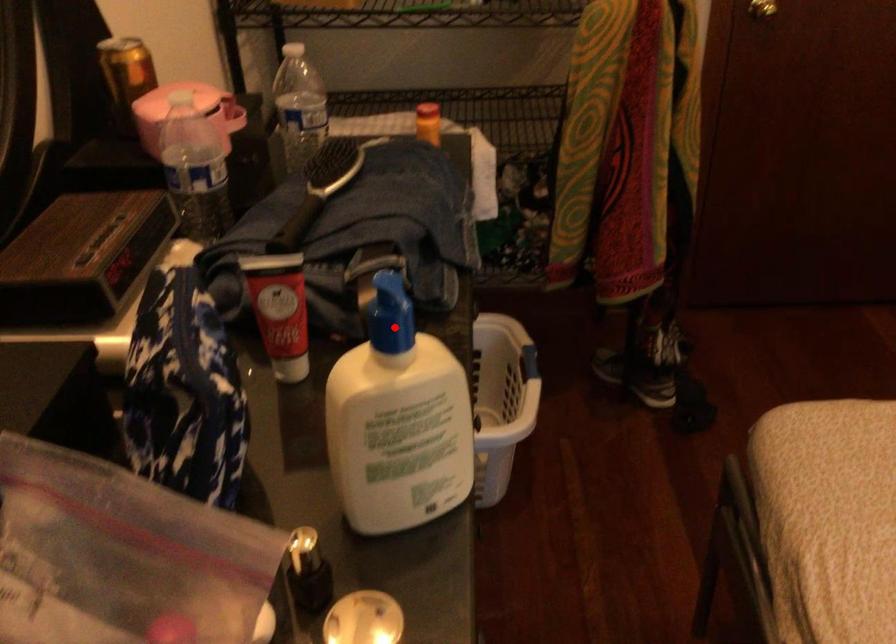
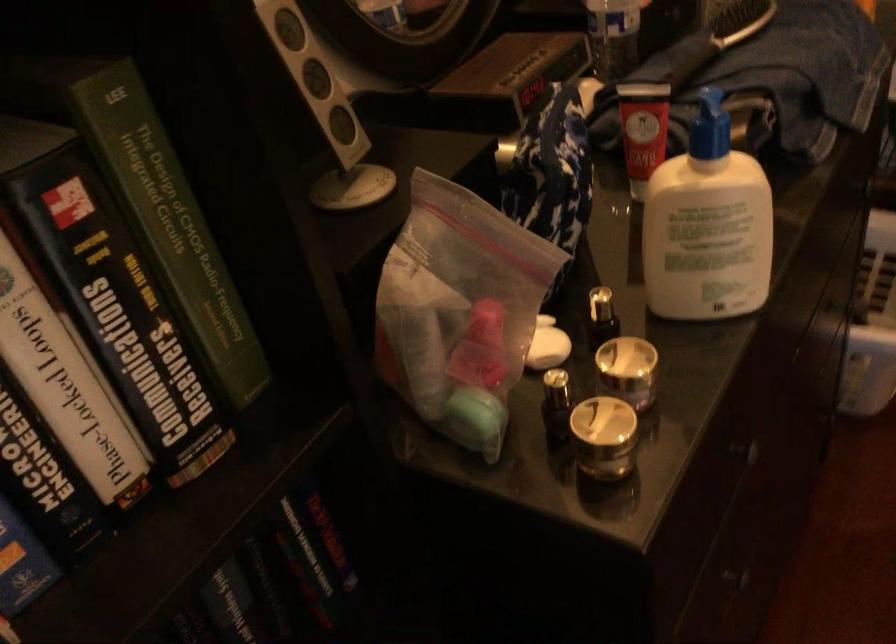
Locate, in the second image, the point that corresponds to the highlighted location in the first image.

(709, 126)